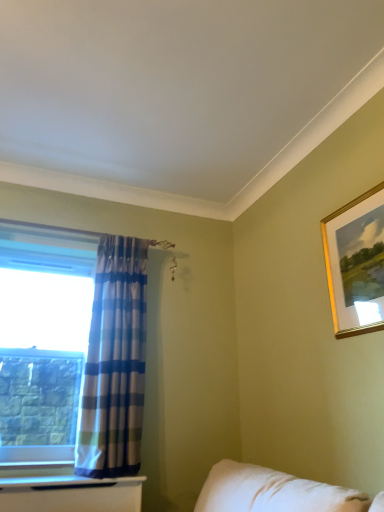
Question: Is blue plaid fabric curtain at left bigger than gold-framed picture at upper right?

Choices:
 (A) no
 (B) yes

Answer: (B)

Question: Does blue plaid fabric curtain at left have a greater height compared to gold-framed picture at upper right?

Choices:
 (A) no
 (B) yes

Answer: (B)

Question: Does blue plaid fabric curtain at left contain gold-framed picture at upper right?

Choices:
 (A) yes
 (B) no

Answer: (B)

Question: Does blue plaid fabric curtain at left have a lesser width compared to gold-framed picture at upper right?

Choices:
 (A) no
 (B) yes

Answer: (A)

Question: From a real-world perspective, is blue plaid fabric curtain at left over gold-framed picture at upper right?

Choices:
 (A) yes
 (B) no

Answer: (B)

Question: Considering their positions, is blue plaid fabric curtain at left located in front of or behind gold-framed picture at upper right?

Choices:
 (A) front
 (B) behind

Answer: (B)

Question: From their relative heights in the image, would you say blue plaid fabric curtain at left is taller or shorter than gold-framed picture at upper right?

Choices:
 (A) short
 (B) tall

Answer: (B)

Question: Would you say blue plaid fabric curtain at left is to the left or to the right of gold-framed picture at upper right in the picture?

Choices:
 (A) left
 (B) right

Answer: (A)

Question: From a real-world perspective, is blue plaid fabric curtain at left physically located above or below gold-framed picture at upper right?

Choices:
 (A) above
 (B) below

Answer: (B)

Question: From a real-world perspective, is gold-framed picture at upper right positioned above or below clear glass window at left?

Choices:
 (A) above
 (B) below

Answer: (A)

Question: Is point (345, 310) closer or farther from the camera than point (6, 388)?

Choices:
 (A) closer
 (B) farther

Answer: (A)

Question: In the image, is gold-framed picture at upper right on the left side or the right side of clear glass window at left?

Choices:
 (A) left
 (B) right

Answer: (B)

Question: Looking at the image, does gold-framed picture at upper right seem bigger or smaller compared to clear glass window at left?

Choices:
 (A) small
 (B) big

Answer: (A)

Question: Is point (46, 372) positioned closer to the camera than point (352, 242)?

Choices:
 (A) farther
 (B) closer

Answer: (A)

Question: Based on their sizes in the image, would you say clear glass window at left is bigger or smaller than gold-framed picture at upper right?

Choices:
 (A) small
 (B) big

Answer: (B)